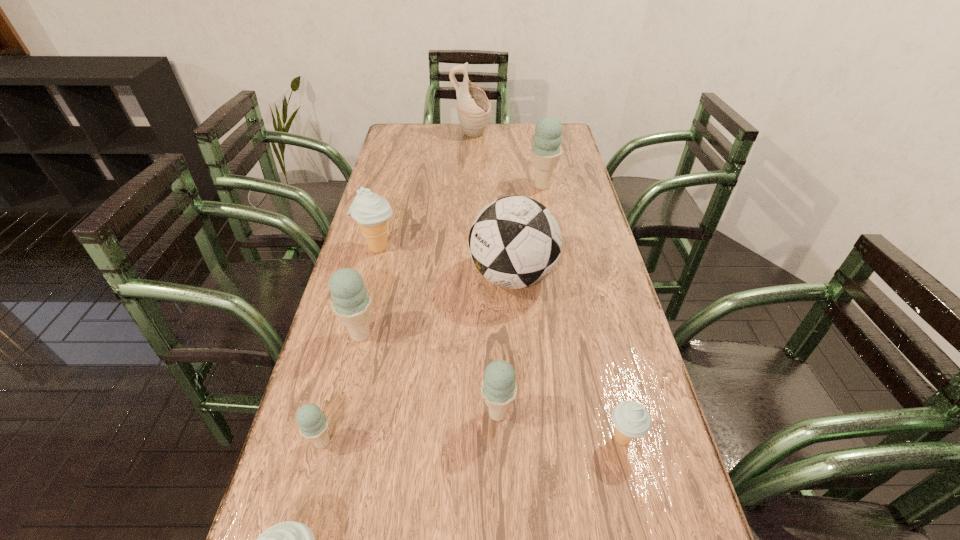
Locate an element on the screen. This screenshot has width=960, height=540. the smallest beige icecream is located at coordinates (631, 420).

Where is `the rightmost beige icecream`? the rightmost beige icecream is located at coordinates (631, 420).

Image resolution: width=960 pixels, height=540 pixels. Identify the location of the smallest blue ice cream. (313, 424).

Identify the location of vacant space located 0.310m at the spout of the farthest object. Image resolution: width=960 pixels, height=540 pixels. (564, 135).

Image resolution: width=960 pixels, height=540 pixels. Identify the location of free space located 0.250m on the front of the second farthest object. (553, 240).

Locate an element on the screen. vacant space located 0.200m on the surface of the soccer ball where the brand logo is visible is located at coordinates (398, 276).

You are a GUI agent. You are given a task and a screenshot of the screen. Output one action in this format:
    pyautogui.click(x=<x>, y=<y>)
    Task: Click on the vacant region located on the surface of the soccer ball where the brand logo is visible
    
    Given the screenshot: What is the action you would take?
    pyautogui.click(x=416, y=276)

Find the location of a particular element. This screenshot has height=540, width=960. free space located 0.290m on the surface of the soccer ball where the brand logo is visible is located at coordinates (366, 276).

Image resolution: width=960 pixels, height=540 pixels. I want to click on vacant space located 0.320m on the right of the biggest beige icecream, so coord(505,248).

Locate an element on the screen. The image size is (960, 540). vacant space located on the front of the fifth nearest ice cream is located at coordinates pos(322,495).